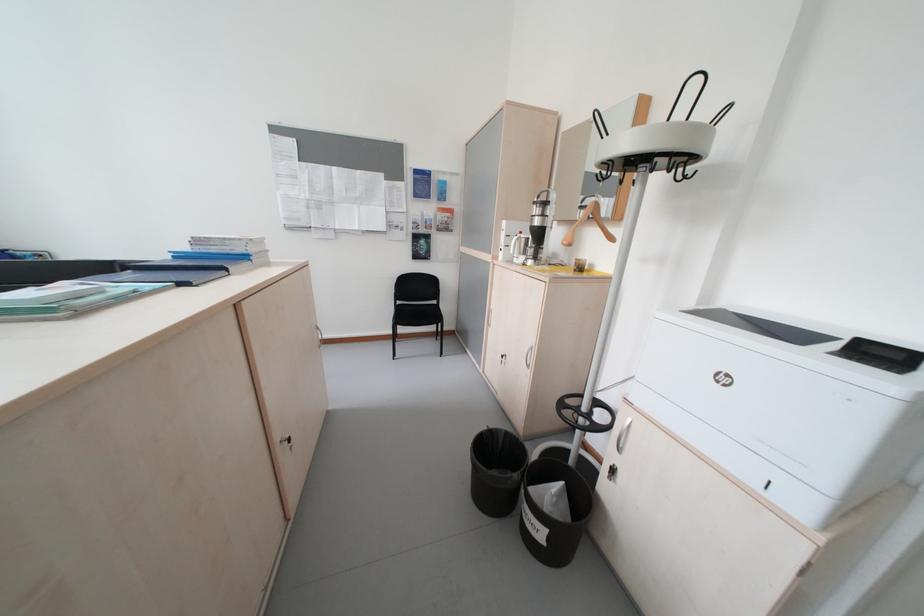
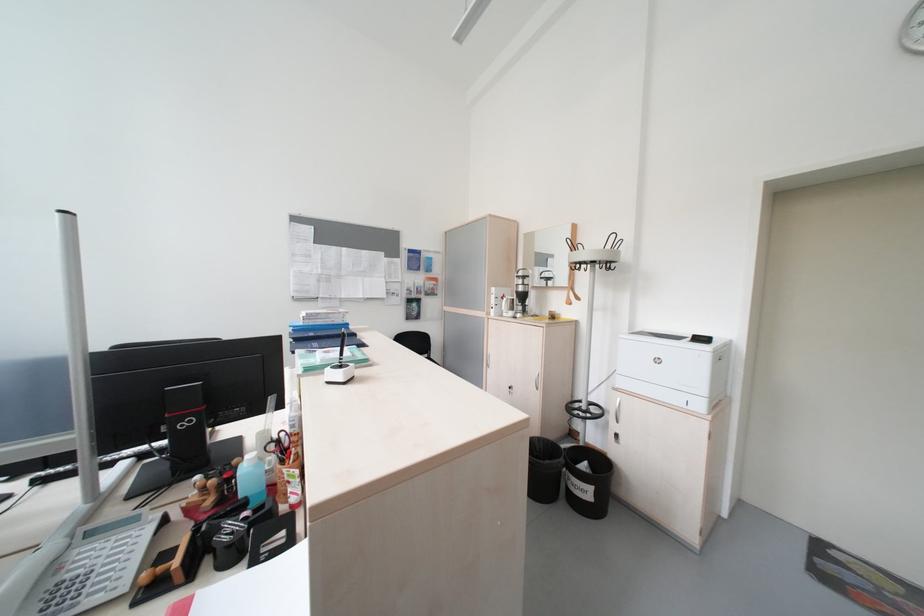
The point at (535,254) is marked in the first image. Where is the corresponding point in the second image?

(523, 310)